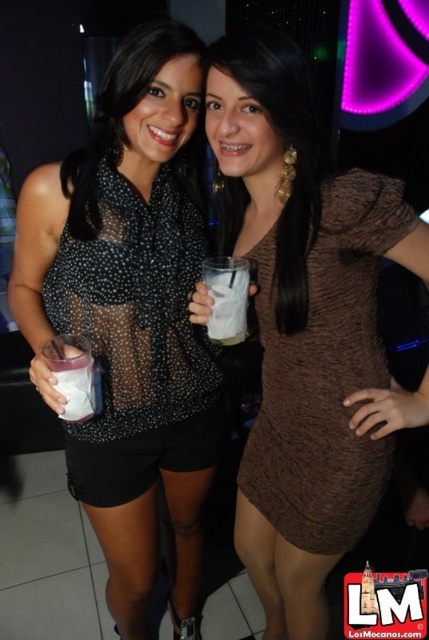
Question: Is brown textured dress at center positioned behind white frothy drink at center?

Choices:
 (A) no
 (B) yes

Answer: (A)

Question: Is brown textured dress at center bigger than white opaque cup at lower left?

Choices:
 (A) yes
 (B) no

Answer: (A)

Question: Can you confirm if black sheer top at center is wider than white frothy drink at center?

Choices:
 (A) no
 (B) yes

Answer: (B)

Question: Which point is farther to the camera?

Choices:
 (A) (96, 403)
 (B) (355, 518)

Answer: (B)

Question: Which object appears closest to the camera in this image?

Choices:
 (A) black sheer top at center
 (B) white opaque cup at lower left

Answer: (B)

Question: Among these objects, which one is farthest from the camera?

Choices:
 (A) sheer black blouse at center
 (B) brown textured dress at center

Answer: (A)